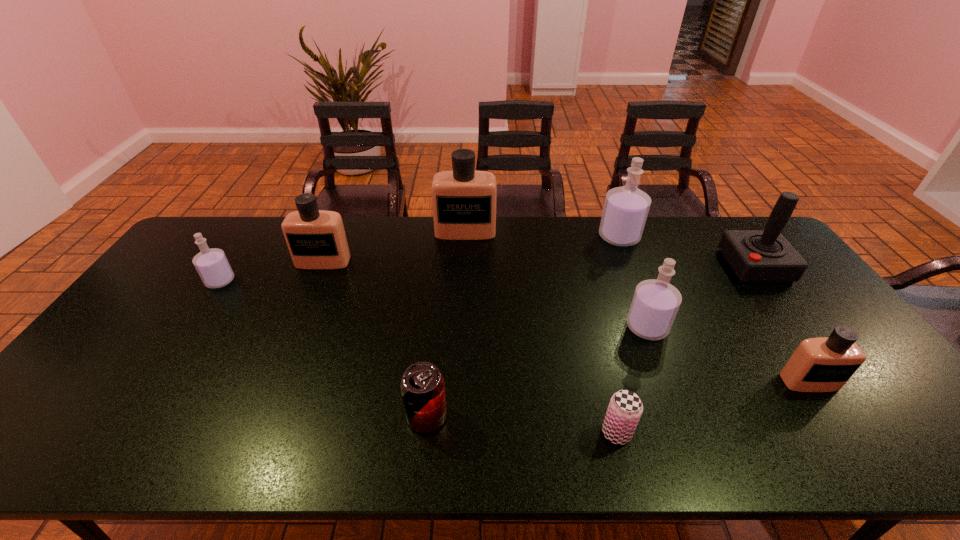
Where is `the farthest purple perfume`? This screenshot has width=960, height=540. the farthest purple perfume is located at coordinates (626, 208).

Find the location of a particular element. Image resolution: width=960 pixels, height=540 pixels. the second beige perfume from left to right is located at coordinates (464, 200).

The width and height of the screenshot is (960, 540). I want to click on the biggest beige perfume, so [x=464, y=200].

Where is `red joystick`? The height and width of the screenshot is (540, 960). red joystick is located at coordinates (765, 255).

Locate an element on the screen. The height and width of the screenshot is (540, 960). the nearest purple perfume is located at coordinates (655, 303).

I want to click on the second nearest perfume, so click(x=655, y=303).

Locate an element on the screen. The image size is (960, 540). the second smallest beige perfume is located at coordinates (316, 239).

The width and height of the screenshot is (960, 540). I want to click on the third farthest perfume, so click(316, 239).

This screenshot has width=960, height=540. In order to click on the leftmost perfume in this screenshot , I will do pos(212,265).

Locate an element on the screen. The image size is (960, 540). the second farthest purple perfume is located at coordinates (212, 265).